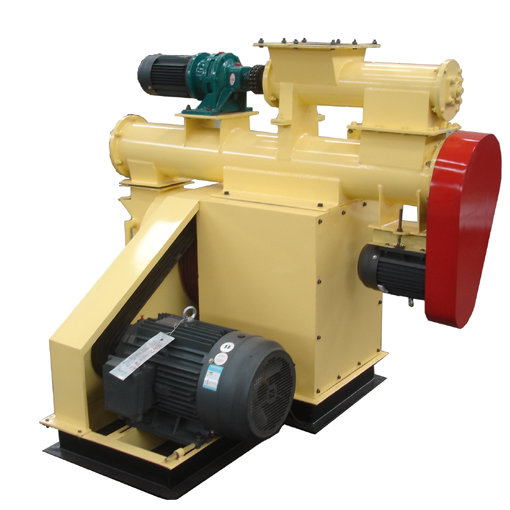
Locate an element on the screen. fan is located at coordinates [x=263, y=387].